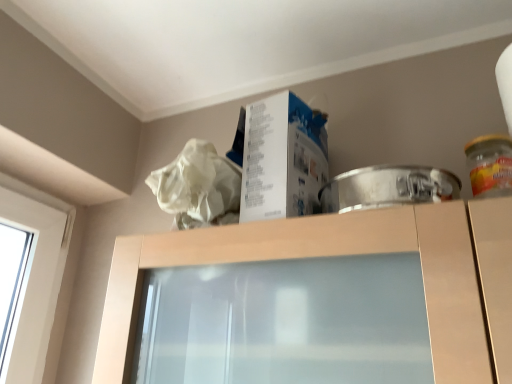
This screenshot has width=512, height=384. I want to click on translucent glass jar at right, so click(490, 165).

What do you see at coordinates (490, 165) in the screenshot?
I see `translucent glass jar at right` at bounding box center [490, 165].

What is the approximate height of translucent glass jar at right?

5.07 inches.

What do you see at coordinates (282, 158) in the screenshot? The image size is (512, 384). I see `white paperboard box at upper center` at bounding box center [282, 158].

Where is `white paperboard box at upper center`? This screenshot has height=384, width=512. white paperboard box at upper center is located at coordinates [282, 158].

The image size is (512, 384). What are the coordinates of `translucent glass jar at right` in the screenshot? It's located at (490, 165).

Is white paperboard box at upper center at the left side of translucent glass jar at right?

Indeed, white paperboard box at upper center is positioned on the left side of translucent glass jar at right.

Is white paperboard box at upper center further to camera compared to translucent glass jar at right?

Yes, white paperboard box at upper center is further from the viewer.

Is point (295, 150) positioned before point (480, 191)?

No, (295, 150) is behind (480, 191).

From the image's perspective, is white paperboard box at upper center on translucent glass jar at right?

Correct, white paperboard box at upper center appears higher than translucent glass jar at right in the image.

From a real-world perspective, is white paperboard box at upper center located beneath translucent glass jar at right?

Actually, white paperboard box at upper center is physically above translucent glass jar at right in the real world.

Which object is wider, white paperboard box at upper center or translucent glass jar at right?

Wider between the two is white paperboard box at upper center.

Considering the sizes of white paperboard box at upper center and translucent glass jar at right in the image, is white paperboard box at upper center taller or shorter than translucent glass jar at right?

Considering their sizes, white paperboard box at upper center has more height than translucent glass jar at right.

Which of these two, white paperboard box at upper center or translucent glass jar at right, is bigger?

With larger size is white paperboard box at upper center.

Is white paperboard box at upper center not within translucent glass jar at right?

Yes, white paperboard box at upper center is located beyond the bounds of translucent glass jar at right.

Is white paperboard box at upper center far away from translucent glass jar at right?

white paperboard box at upper center is near translucent glass jar at right, not far away.

Looking at this image, is white paperboard box at upper center positioned with its back to translucent glass jar at right?

No, white paperboard box at upper center is not facing the opposite direction of translucent glass jar at right.

How different are the orientations of white paperboard box at upper center and translucent glass jar at right in degrees?

white paperboard box at upper center and translucent glass jar at right are facing 0.006 degrees away from each other.

The image size is (512, 384). I want to click on box behind the translucent glass jar at right, so click(282, 158).

Considering the positions of objects translucent glass jar at right and white paperboard box at upper center in the image provided, who is more to the right, translucent glass jar at right or white paperboard box at upper center?

translucent glass jar at right is more to the right.

Considering their positions, is translucent glass jar at right located in front of or behind white paperboard box at upper center?

In the image, translucent glass jar at right appears in front of white paperboard box at upper center.

Which is in front, point (476, 187) or point (316, 171)?

Point (476, 187)

From the picture: From the image's perspective, is translucent glass jar at right beneath white paperboard box at upper center?

Yes, from the image's perspective, translucent glass jar at right is below white paperboard box at upper center.

From a real-world perspective, who is located higher, translucent glass jar at right or white paperboard box at upper center?

From a 3D spatial view, white paperboard box at upper center is above.

Between translucent glass jar at right and white paperboard box at upper center, which one has larger width?

With larger width is white paperboard box at upper center.

Is translucent glass jar at right taller or shorter than white paperboard box at upper center?

Clearly, translucent glass jar at right is shorter compared to white paperboard box at upper center.

Between translucent glass jar at right and white paperboard box at upper center, which one has smaller size?

With smaller size is translucent glass jar at right.

Would you say translucent glass jar at right contains white paperboard box at upper center?

No, white paperboard box at upper center is located outside of translucent glass jar at right.

Is translucent glass jar at right in contact with white paperboard box at upper center?

No, translucent glass jar at right is not next to white paperboard box at upper center.

Is translucent glass jar at right facing towards white paperboard box at upper center?

No, translucent glass jar at right is not aimed at white paperboard box at upper center.

How many degrees apart are the facing directions of translucent glass jar at right and white paperboard box at upper center?

translucent glass jar at right and white paperboard box at upper center are facing 0.006 degrees away from each other.

Measure the distance between translucent glass jar at right and white paperboard box at upper center.

translucent glass jar at right and white paperboard box at upper center are 11.97 inches apart.

Identify the location of glass jar on the right of the white paperboard box at upper center. The width and height of the screenshot is (512, 384). (490, 165).

I want to click on box lying above the translucent glass jar at right (from the image's perspective), so click(282, 158).

At what (x,y) coordinates should I click in order to perform the action: click on glass jar that is on the right side of white paperboard box at upper center. Please return your answer as a coordinate pair (x, y). The height and width of the screenshot is (384, 512). Looking at the image, I should click on (490, 165).